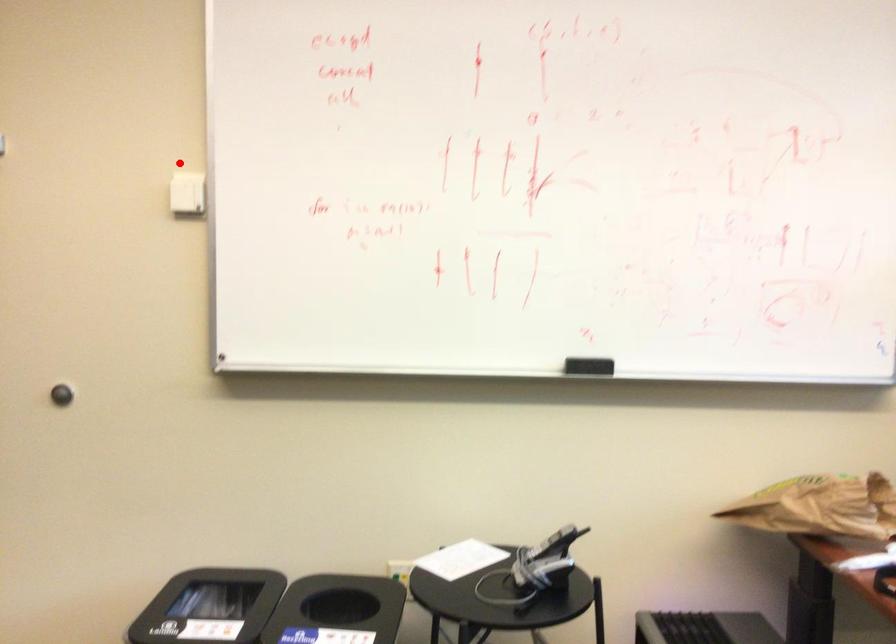
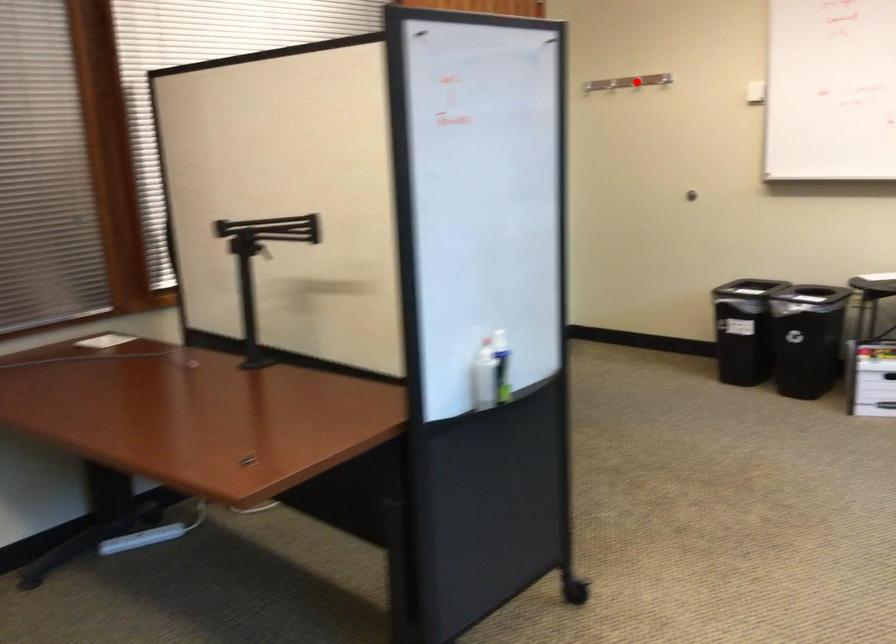
I am providing you with two images of the same scene from different viewpoints. A red point is marked on the first image and another point is marked on the second image. Is the red point in image1 aligned with the point shown in image2?

No